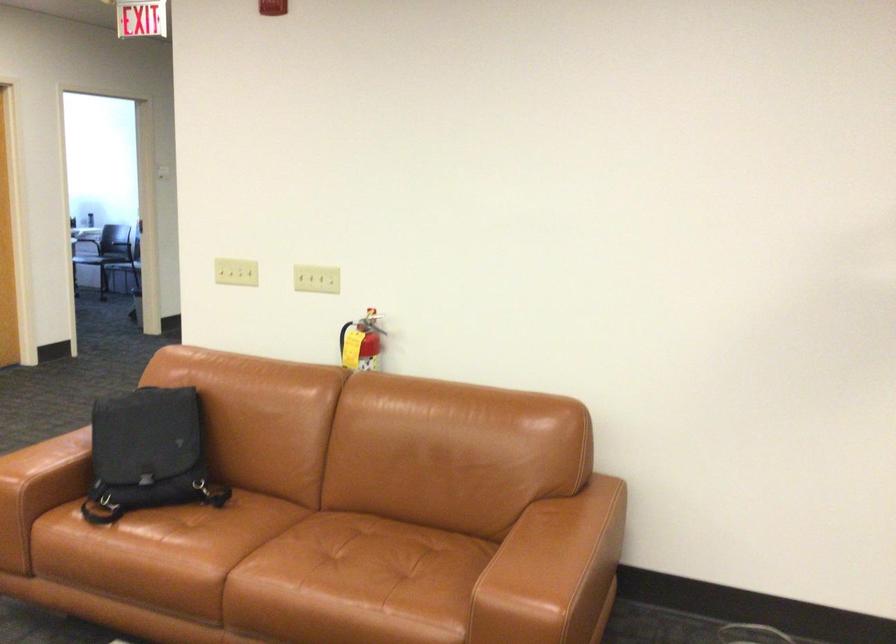
Image resolution: width=896 pixels, height=644 pixels. Describe the element at coordinates (148, 453) in the screenshot. I see `the backpack buckle` at that location.